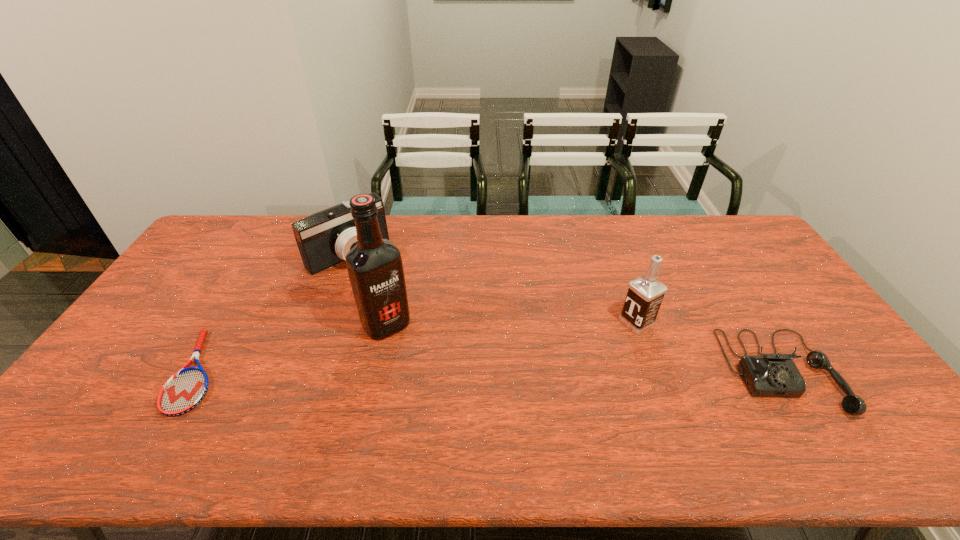
Locate an element on the screen. The width and height of the screenshot is (960, 540). tennis racket situated at the near edge is located at coordinates (185, 390).

Where is `telephone located in the near edge section of the desktop`? telephone located in the near edge section of the desktop is located at coordinates (770, 375).

Where is `object that is at the right edge`? Image resolution: width=960 pixels, height=540 pixels. object that is at the right edge is located at coordinates (770, 375).

Find the location of `object present at the near right corner`. object present at the near right corner is located at coordinates (770, 375).

Where is `vacant space at the far edge of the desktop`? The height and width of the screenshot is (540, 960). vacant space at the far edge of the desktop is located at coordinates (671, 238).

In the image, there is a desktop. Find the location of `vacant space at the near edge`. vacant space at the near edge is located at coordinates (686, 388).

This screenshot has width=960, height=540. Identify the location of free region at the left edge of the desktop. (191, 314).

I want to click on blank area at the right edge, so click(x=787, y=320).

Locate an element on the screen. unoccupied area between the telephone and the tennis racket is located at coordinates pyautogui.click(x=490, y=372).

In order to click on empty location between the leftmost object and the farthest object in this screenshot , I will do `click(274, 313)`.